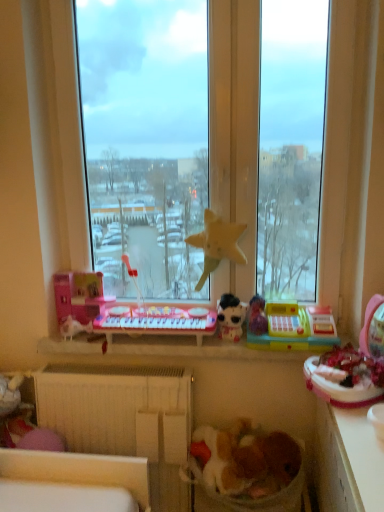
At what (x,y) coordinates should I click in order to perform the action: click on free point below yellow plastic cash register at center, the first toy from the right (from a real-world perspective). Please return your answer as a coordinate pair (x, y). This screenshot has width=384, height=512. Looking at the image, I should click on (290, 351).